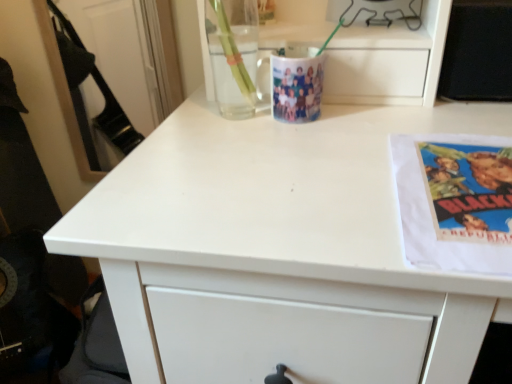
Question: Does transparent glass mug at upper center have a greater height compared to metallic wire at upper center?

Choices:
 (A) no
 (B) yes

Answer: (A)

Question: Is transparent glass mug at upper center positioned behind metallic wire at upper center?

Choices:
 (A) yes
 (B) no

Answer: (B)

Question: From a real-world perspective, is transparent glass mug at upper center over metallic wire at upper center?

Choices:
 (A) no
 (B) yes

Answer: (A)

Question: Can you confirm if transparent glass mug at upper center is shorter than metallic wire at upper center?

Choices:
 (A) yes
 (B) no

Answer: (A)

Question: From the image's perspective, is transparent glass mug at upper center beneath metallic wire at upper center?

Choices:
 (A) no
 (B) yes

Answer: (B)

Question: Is transparent glass mug at upper center turned away from metallic wire at upper center?

Choices:
 (A) yes
 (B) no

Answer: (B)

Question: Can you confirm if metallic wire at upper center is positioned to the right of white paper at right?

Choices:
 (A) no
 (B) yes

Answer: (A)

Question: From the image's perspective, is metallic wire at upper center on top of white paper at right?

Choices:
 (A) no
 (B) yes

Answer: (B)

Question: Is metallic wire at upper center smaller than white paper at right?

Choices:
 (A) no
 (B) yes

Answer: (A)

Question: Considering the relative sizes of metallic wire at upper center and white paper at right in the image provided, is metallic wire at upper center thinner than white paper at right?

Choices:
 (A) yes
 (B) no

Answer: (A)

Question: Is metallic wire at upper center wider than white paper at right?

Choices:
 (A) no
 (B) yes

Answer: (A)

Question: From a real-world perspective, is metallic wire at upper center beneath white paper at right?

Choices:
 (A) yes
 (B) no

Answer: (B)

Question: Considering the relative sizes of white paper at right and metallic wire at upper center in the image provided, is white paper at right shorter than metallic wire at upper center?

Choices:
 (A) no
 (B) yes

Answer: (B)